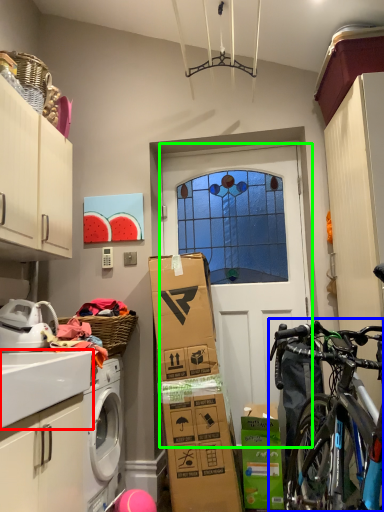
Question: Estimate the real-world distances between objects in this image. Which object is farther from counter top (highlighted by a red box), bicycle (highlighted by a blue box) or door (highlighted by a green box)?

Choices:
 (A) bicycle
 (B) door

Answer: (B)